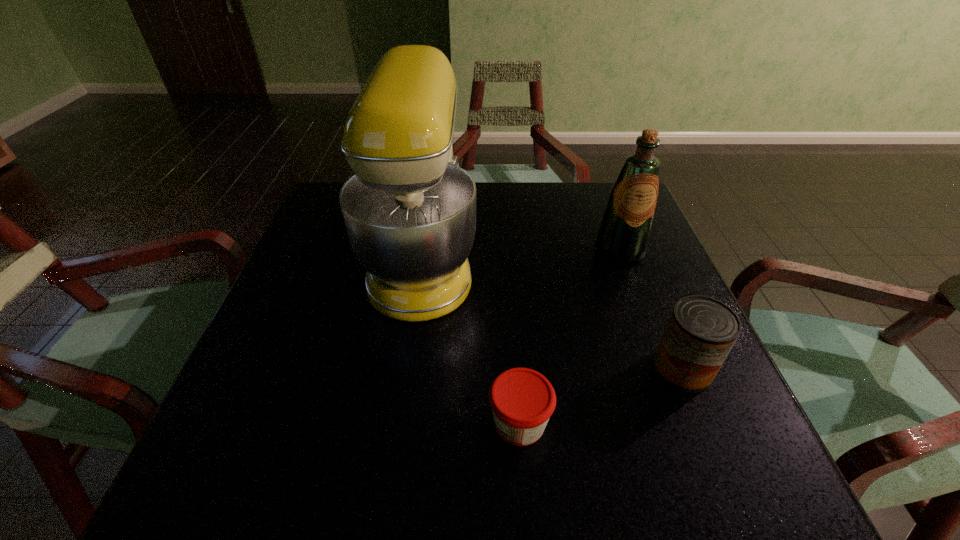
Where is `vacant area that lies between the tallest object and the can`? vacant area that lies between the tallest object and the can is located at coordinates (553, 314).

You are a GUI agent. You are given a task and a screenshot of the screen. Output one action in this format:
    pyautogui.click(x=<x>, y=<y>)
    Task: Click on the vacant region between the third farthest object and the tallest object
    This screenshot has height=540, width=960.
    Given the screenshot: What is the action you would take?
    pyautogui.click(x=553, y=314)

Where is `vacant area that lies between the shortest object and the leftmost object`? The width and height of the screenshot is (960, 540). vacant area that lies between the shortest object and the leftmost object is located at coordinates (471, 341).

Select which object appears as the closest to the second nearest object. Please provide its 2D coordinates. Your answer should be formatted as a tuple, i.e. [(x, y)], where the tuple contains the x and y coordinates of a point satisfying the conditions above.

[(522, 400)]

Identify the location of object that can be found as the second closest to the jam. (701, 331).

The height and width of the screenshot is (540, 960). Identify the location of free spot that satisfies the following two spatial constraints: 1. on the front-facing side of the olive oil; 2. on the side of the tallest object with the control knob. (623, 259).

This screenshot has width=960, height=540. In order to click on vacant space that satisfies the following two spatial constraints: 1. on the side of the can with the control knob; 2. on the right side of the mixer in this screenshot , I will do `click(407, 368)`.

Locate an element on the screen. free location that satisfies the following two spatial constraints: 1. on the side of the leftmost object with the control knob; 2. on the back side of the can is located at coordinates (407, 368).

Where is `free region that satisfies the following two spatial constraints: 1. on the front-facing side of the olive oil; 2. on the side of the tallest object with the control knob`? The height and width of the screenshot is (540, 960). free region that satisfies the following two spatial constraints: 1. on the front-facing side of the olive oil; 2. on the side of the tallest object with the control knob is located at coordinates (623, 259).

Locate an element on the screen. The image size is (960, 540). vacant point that satisfies the following two spatial constraints: 1. on the side of the mixer with the control knob; 2. on the left side of the third farthest object is located at coordinates (407, 368).